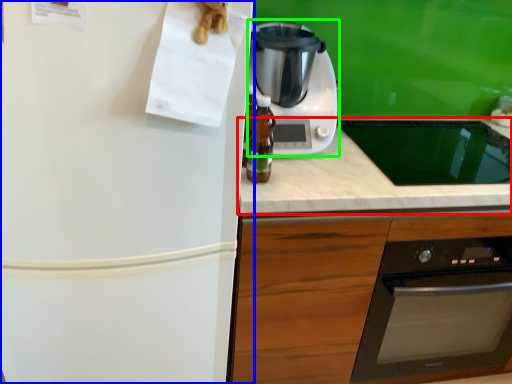
Question: Considering the real-world distances, which object is closest to countertop (highlighted by a red box)? refrigerator (highlighted by a blue box) or kitchen appliance (highlighted by a green box).

Choices:
 (A) refrigerator
 (B) kitchen appliance

Answer: (B)